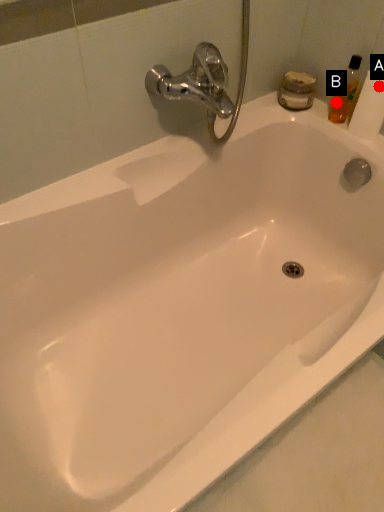
Question: Two points are circled on the image, labeled by A and B beside each circle. Among these points, which one is farthest from the camera?

Choices:
 (A) A is further
 (B) B is further

Answer: (B)